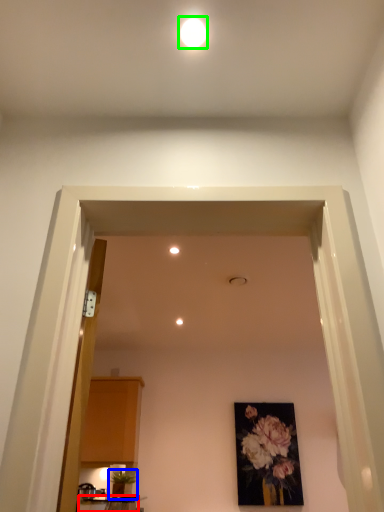
Question: Based on their relative distances, which object is nearer to table (highlighted by a red box)? Choose from houseplant (highlighted by a blue box) and lighting (highlighted by a green box).

Choices:
 (A) houseplant
 (B) lighting

Answer: (A)